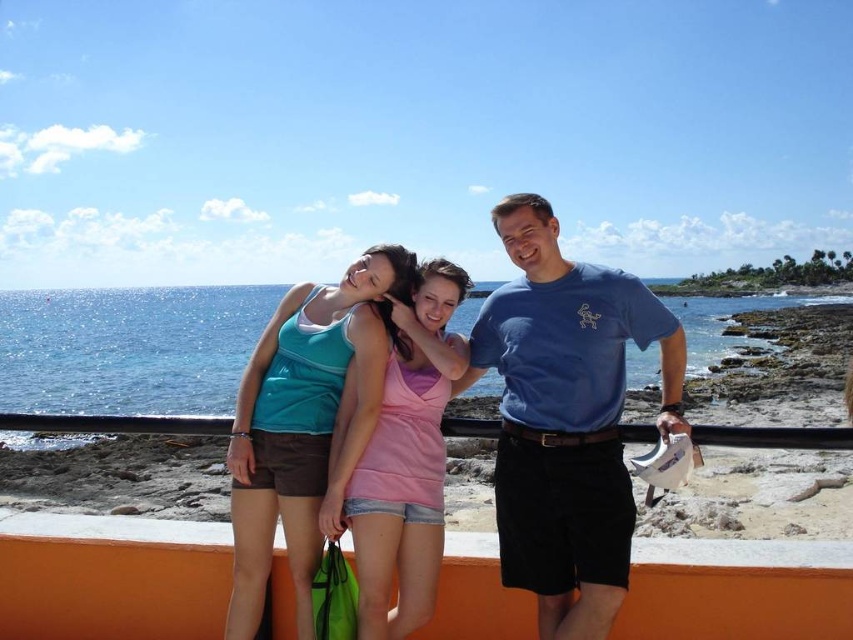
You are taking a photo of the seaside scene and want to focus on both point (624,563) and point (252,580). Which point should you adjust your focus to first to ensure it is sharp in the image?

You should focus on point (624,563) first because it is closer to the camera than point (252,580). Since it is nearer, achieving sharp focus on it first will help in properly capturing both points in the image.

You are standing at the point with coordinates point (x=637, y=580) and want to walk to the point with coordinates point (x=251, y=416). Which direction should you move in to reach your destination?

You should move backward because point (x=637, y=580) is in front of point (x=251, y=416).

You are a photographer trying to capture the orange concrete ledge at lower center and the matte teal tank top at center. Which object should you adjust your camera to focus on first if you want to capture both in a single frame without moving the camera?

The orange concrete ledge at lower center is to the right of the matte teal tank top at center. Since the matte teal tank top at center is positioned to the left of the orange concrete ledge at lower center, you should focus on the matte teal tank top at center first to ensure both are in frame without moving the camera.